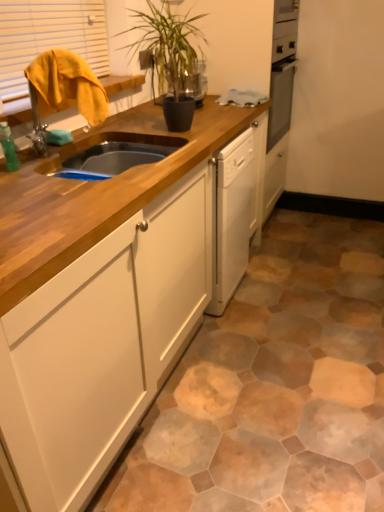
Question: From the image's perspective, is green leafy plant at upper center above or below wooden cabinet at center?

Choices:
 (A) above
 (B) below

Answer: (A)

Question: In terms of width, does green leafy plant at upper center look wider or thinner when compared to wooden cabinet at center?

Choices:
 (A) thin
 (B) wide

Answer: (A)

Question: Considering the real-world distances, which object is farthest from the wooden cabinet at center?

Choices:
 (A) green matte bottle at left
 (B) yellow fabric at upper left
 (C) green leafy plant at upper center

Answer: (B)

Question: Which object is positioned closest to the yellow fabric at upper left?

Choices:
 (A) green matte bottle at left
 (B) green leafy plant at upper center
 (C) wooden cabinet at center

Answer: (B)